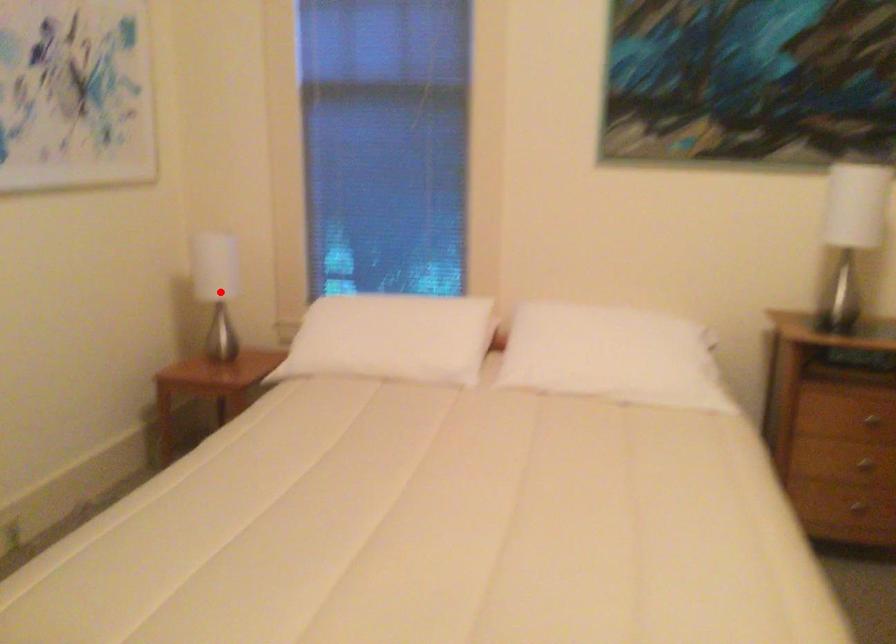
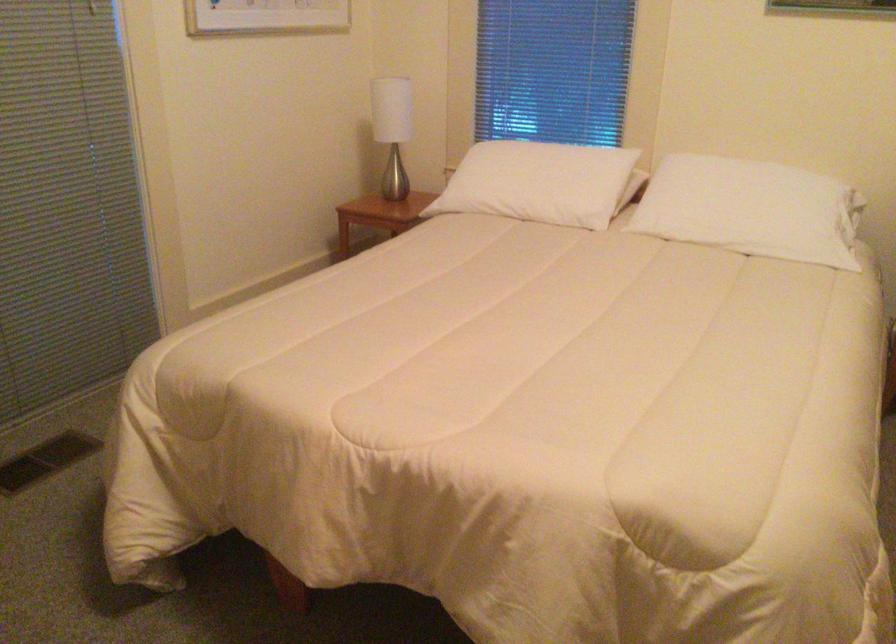
Question: I am providing you with two images of the same scene from different viewpoints. Image1 has a red point marked. In image2, the corresponding 3D location appears at what relative position? Reply with the corresponding letter.

Choices:
 (A) Closer
 (B) Farther

Answer: (B)